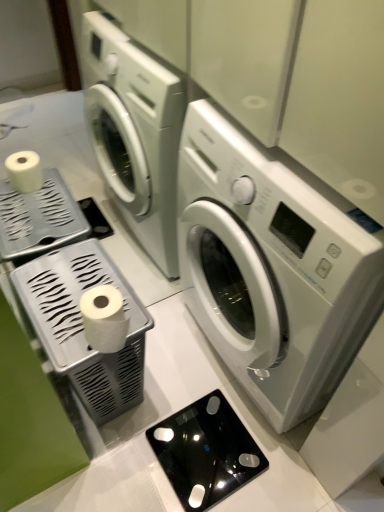
Locate an element on the screen. This screenshot has height=512, width=384. blank space to the left of white glossy toilet paper at lower left is located at coordinates (60, 327).